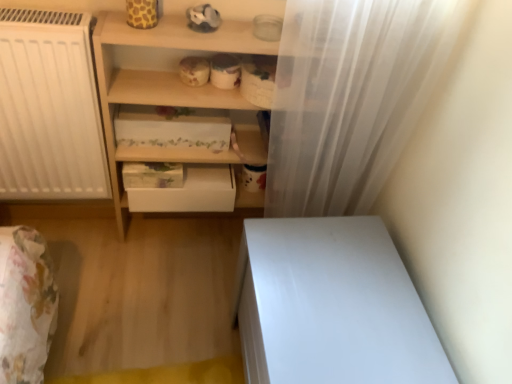
This screenshot has height=384, width=512. I want to click on free point above white matte drawer at center (from a real-world perspective), so click(167, 168).